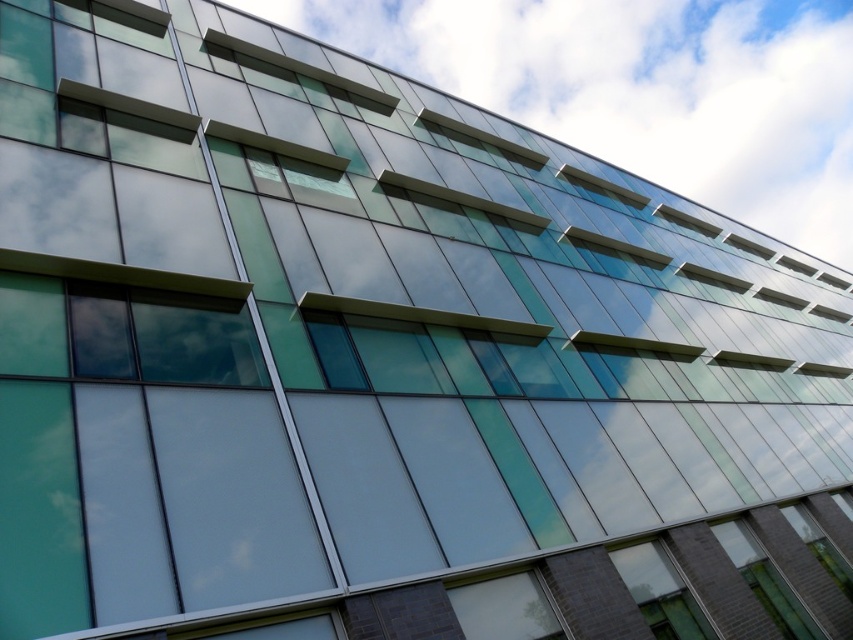
Question: Which object appears closest to the camera in this image?

Choices:
 (A) transparent glass window at lower right
 (B) transparent glass window at upper right
 (C) transparent glass window at upper center

Answer: (A)

Question: Can you confirm if transparent glass window at lower right is wider than transparent glass window at upper center?

Choices:
 (A) yes
 (B) no

Answer: (B)

Question: Is transparent glass window at lower right to the right of transparent glass window at upper right from the viewer's perspective?

Choices:
 (A) no
 (B) yes

Answer: (A)

Question: Does transparent glass window at upper center appear under transparent glass window at upper right?

Choices:
 (A) no
 (B) yes

Answer: (A)

Question: Which of the following is the closest to the observer?

Choices:
 (A) transparent glass window at lower right
 (B) matte glass window at lower right
 (C) transparent glass window at upper right
 (D) transparent glass window at upper center

Answer: (B)

Question: Which of the following is the farthest from the observer?

Choices:
 (A) transparent glass window at lower right
 (B) transparent glass window at upper center
 (C) transparent glass window at upper right
 (D) matte glass window at lower right

Answer: (C)